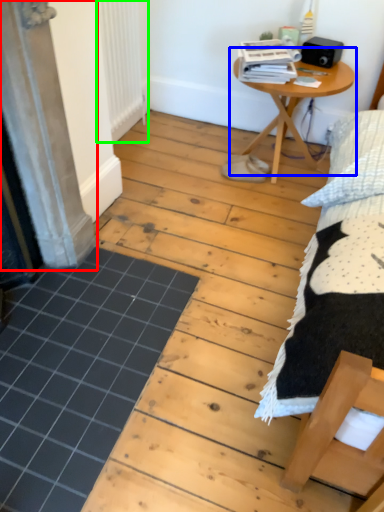
Question: Which is nearer to the screen door (highlighted by a red box)? table (highlighted by a blue box) or radiator (highlighted by a green box).

Choices:
 (A) table
 (B) radiator

Answer: (B)